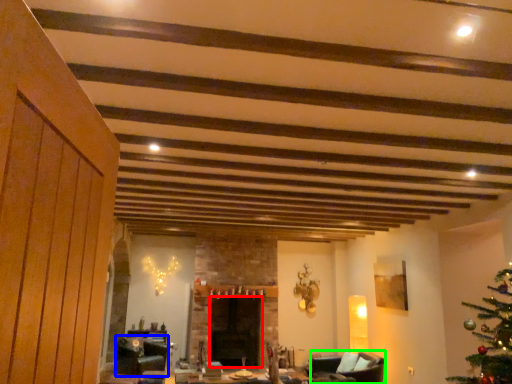
Question: Which object is the farthest from fireplace (highlighted by a red box)? Choose among these: swivel chair (highlighted by a blue box) or armchair (highlighted by a green box).

Choices:
 (A) swivel chair
 (B) armchair

Answer: (B)